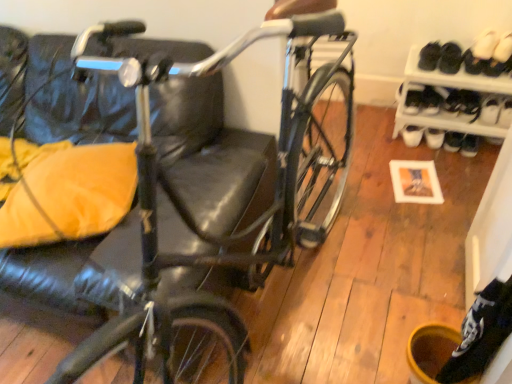
Question: Is white leather shoe at right taller than shiny black bicycle at center?

Choices:
 (A) no
 (B) yes

Answer: (A)

Question: From the image's perspective, is white leather shoe at right located above shiny black bicycle at center?

Choices:
 (A) no
 (B) yes

Answer: (B)

Question: Considering the relative positions of white leather shoe at right and shiny black bicycle at center in the image provided, is white leather shoe at right to the left of shiny black bicycle at center from the viewer's perspective?

Choices:
 (A) no
 (B) yes

Answer: (A)

Question: Is white leather shoe at right touching shiny black bicycle at center?

Choices:
 (A) yes
 (B) no

Answer: (B)

Question: Does white leather shoe at right have a greater width compared to shiny black bicycle at center?

Choices:
 (A) yes
 (B) no

Answer: (B)

Question: Considering the positions of white suede shoe at upper right, arranged as the 2th footwear when viewed from the right, and white suede shoe at upper right, which is the first footwear in right-to-left order, in the image, is white suede shoe at upper right, arranged as the 2th footwear when viewed from the right, taller or shorter than white suede shoe at upper right, which is the first footwear in right-to-left order,?

Choices:
 (A) short
 (B) tall

Answer: (B)

Question: Considering the positions of point (477, 44) and point (504, 61), is point (477, 44) closer or farther from the camera than point (504, 61)?

Choices:
 (A) closer
 (B) farther

Answer: (B)

Question: Considering the relative positions of white suede shoe at upper right, arranged as the 2th footwear when viewed from the right, and white suede shoe at upper right, the third footwear when ordered from left to right, in the image provided, is white suede shoe at upper right, arranged as the 2th footwear when viewed from the right, to the left or to the right of white suede shoe at upper right, the third footwear when ordered from left to right,?

Choices:
 (A) right
 (B) left

Answer: (B)

Question: From the image's perspective, is white suede shoe at upper right, arranged as the 2th footwear when viewed from the right, positioned above or below white suede shoe at upper right, which is the first footwear in right-to-left order?

Choices:
 (A) below
 (B) above

Answer: (B)

Question: From their relative heights in the image, would you say white plastic shoe rack at lower right is taller or shorter than shiny black bicycle at center?

Choices:
 (A) tall
 (B) short

Answer: (B)

Question: From the image's perspective, is white plastic shoe rack at lower right above or below shiny black bicycle at center?

Choices:
 (A) above
 (B) below

Answer: (A)

Question: Choose the correct answer: Is white plastic shoe rack at lower right inside shiny black bicycle at center or outside it?

Choices:
 (A) inside
 (B) outside

Answer: (B)

Question: Considering the positions of point (393, 132) and point (35, 64), is point (393, 132) closer or farther from the camera than point (35, 64)?

Choices:
 (A) closer
 (B) farther

Answer: (B)

Question: From the image's perspective, is white leather shoe at right above or below shiny black bicycle at center?

Choices:
 (A) above
 (B) below

Answer: (A)

Question: From a real-world perspective, is white leather shoe at right above or below shiny black bicycle at center?

Choices:
 (A) below
 (B) above

Answer: (A)